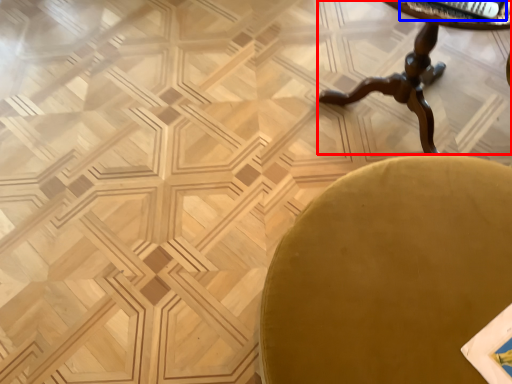
Question: Which point is further to the camera, table (highlighted by a red box) or magazine (highlighted by a blue box)?

Choices:
 (A) table
 (B) magazine

Answer: (B)